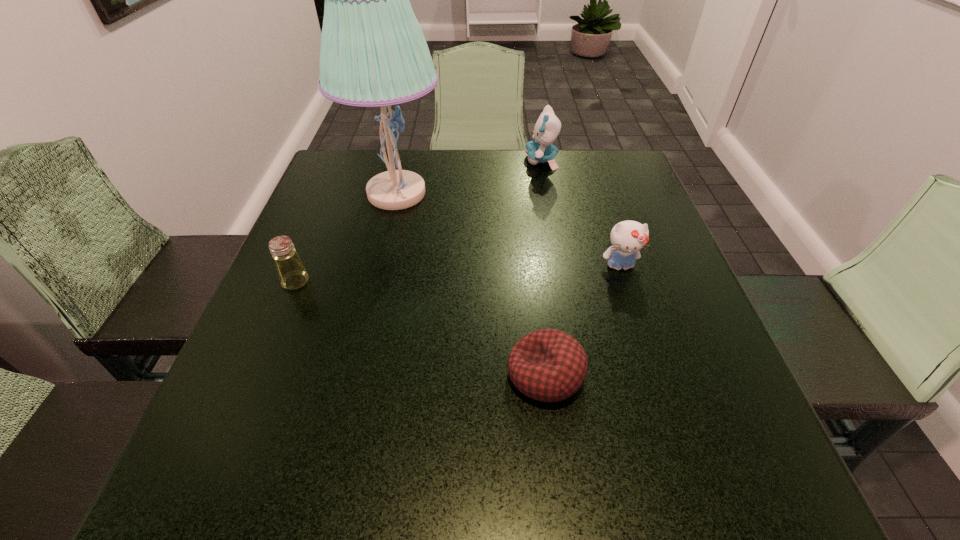
Select which object appears as the closest to the saltshaker. Please provide its 2D coordinates. Your answer should be formatted as a tuple, i.e. [(x, y)], where the tuple contains the x and y coordinates of a point satisfying the conditions above.

[(373, 52)]

Where is `free spot that satisfies the following two spatial constraints: 1. on the front side of the nearest object; 2. on the left side of the leftmost object`? Image resolution: width=960 pixels, height=540 pixels. free spot that satisfies the following two spatial constraints: 1. on the front side of the nearest object; 2. on the left side of the leftmost object is located at coordinates (257, 375).

Where is `blank area in the image that satisfies the following two spatial constraints: 1. on the face of the taller kitten; 2. on the front side of the fourth object from right to left`? Image resolution: width=960 pixels, height=540 pixels. blank area in the image that satisfies the following two spatial constraints: 1. on the face of the taller kitten; 2. on the front side of the fourth object from right to left is located at coordinates (547, 193).